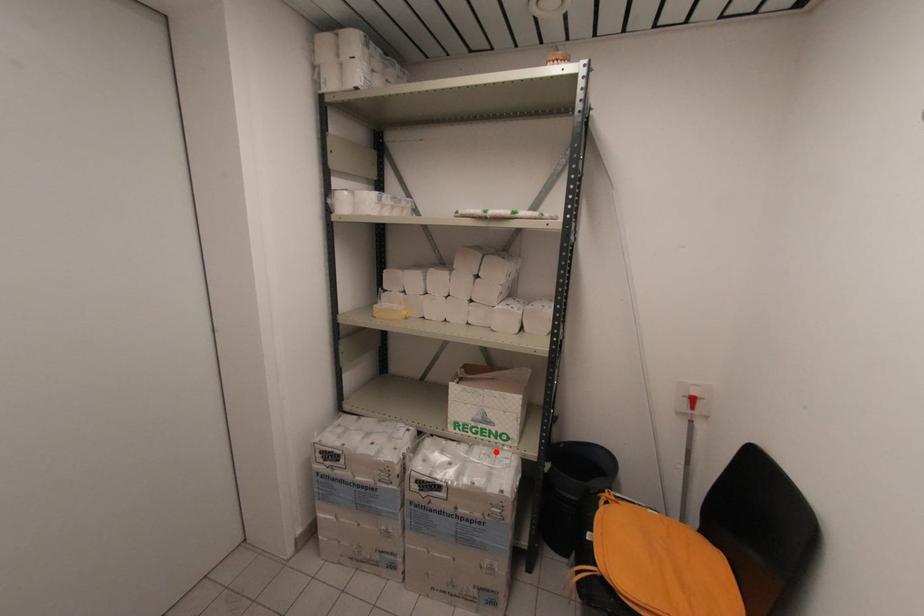
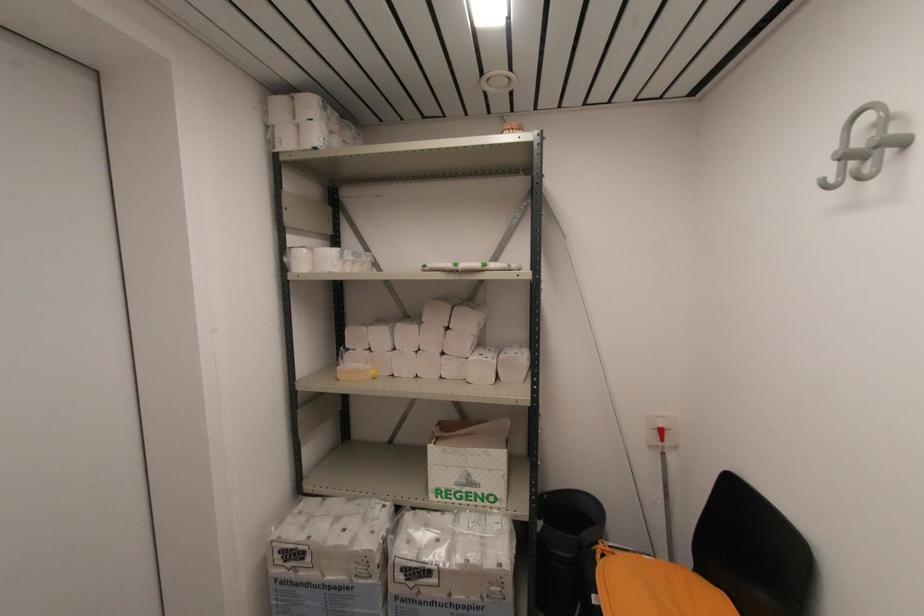
Where in the second image is the point corresponding to the highlighted location from the first image?

(484, 517)